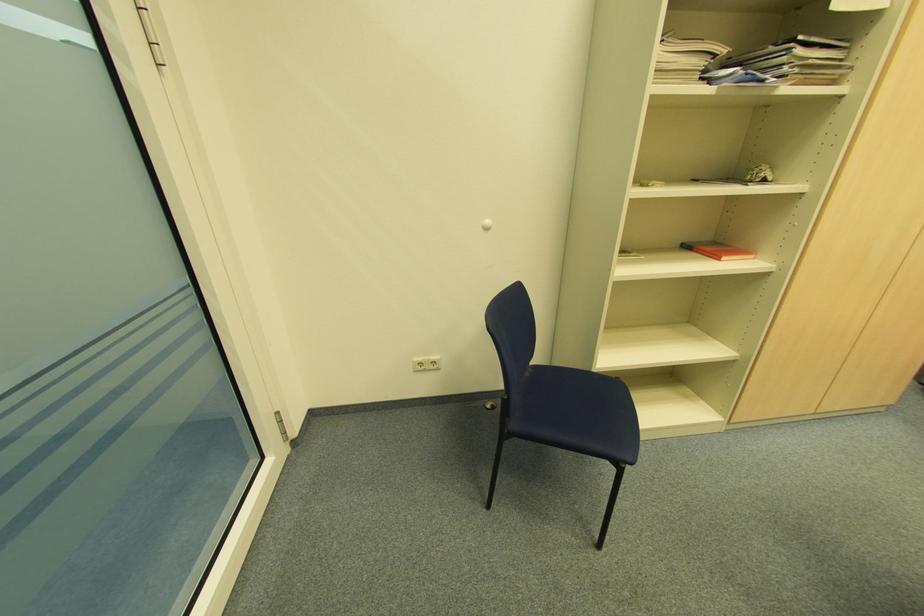
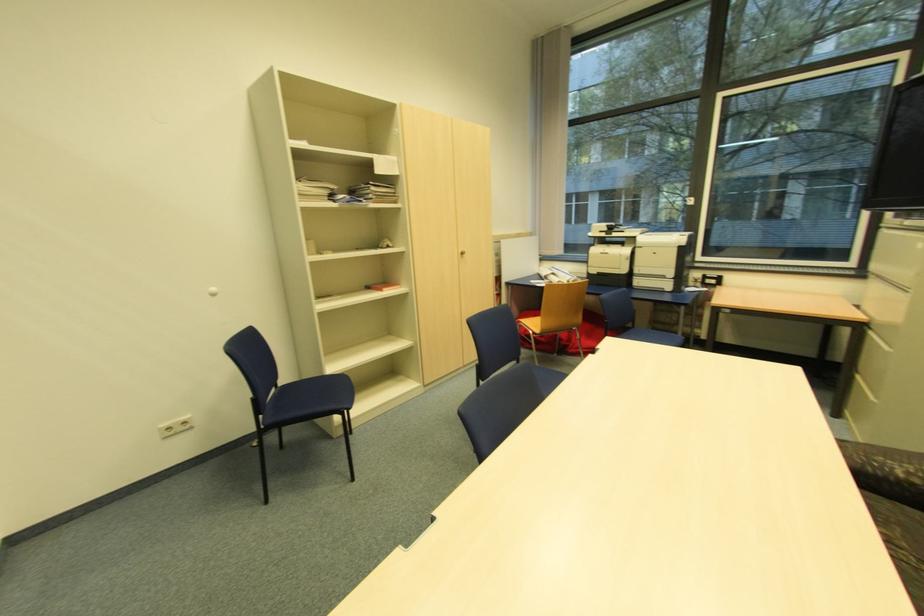
Question: Based on the continuous images, in which direction is the camera rotating? Reply with the corresponding letter.

Choices:
 (A) Left
 (B) Right
 (C) Up
 (D) Down

Answer: (B)